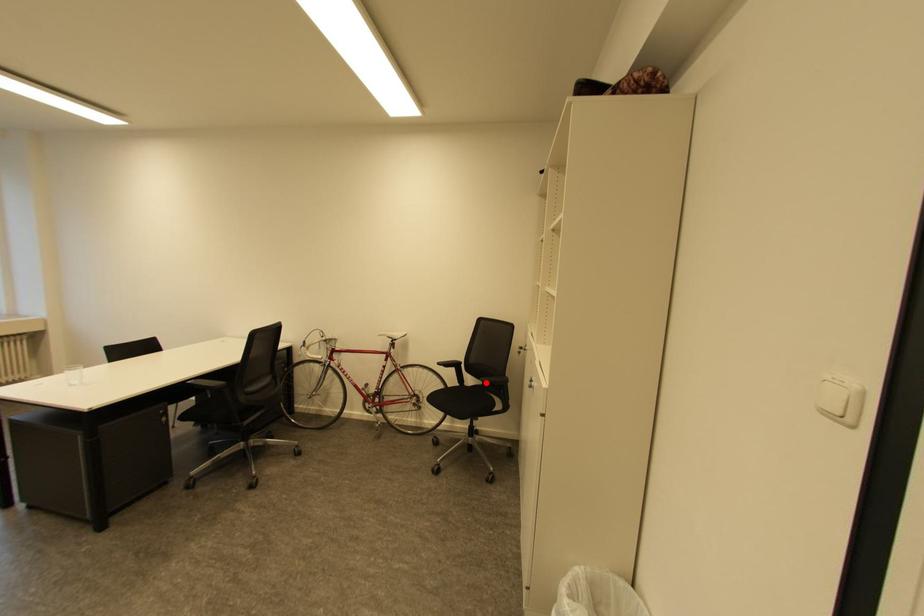
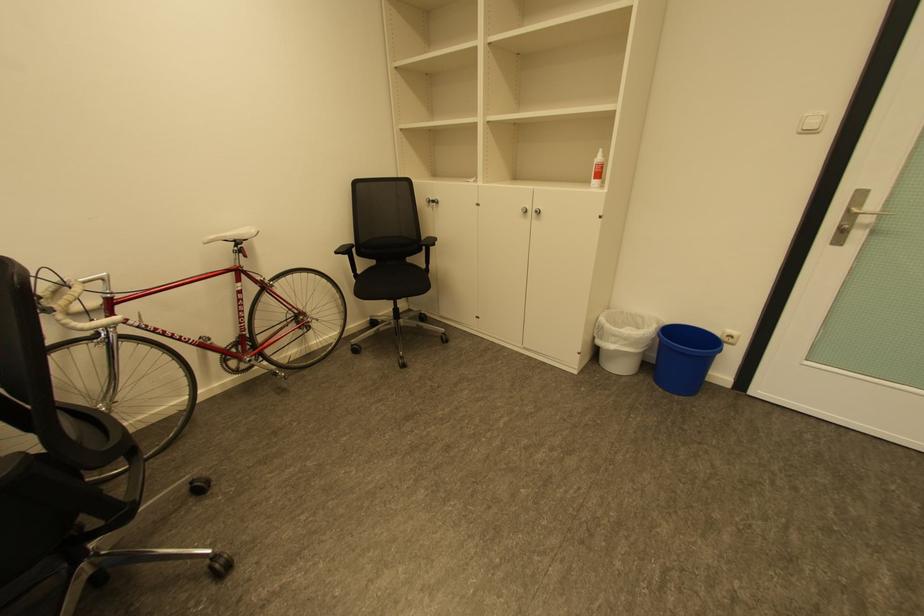
Find the pixel in the second image that matches the highlighted location in the first image.

(380, 262)